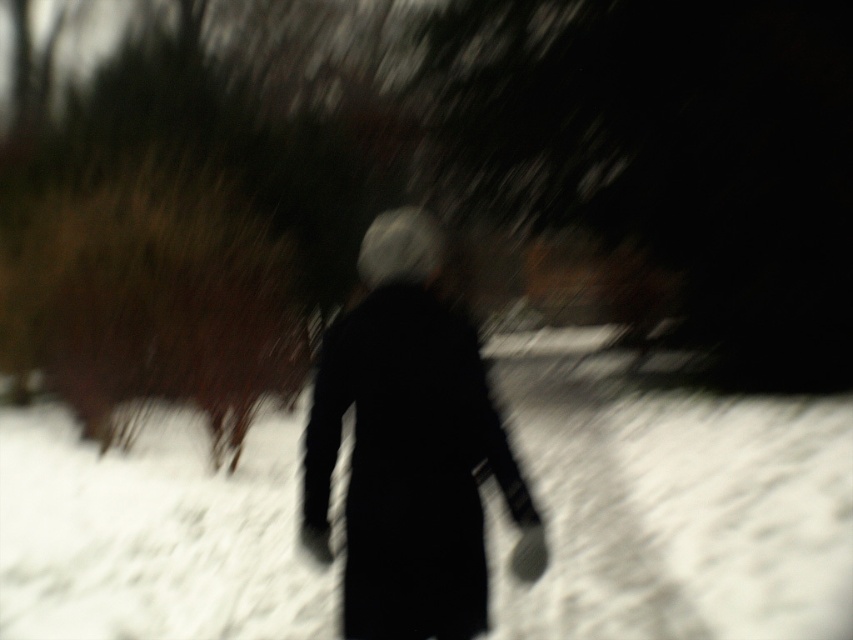
Question: Which point is farther from the camera taking this photo?

Choices:
 (A) (62, 460)
 (B) (456, 596)

Answer: (A)

Question: Does white fluffy snow at center appear on the left side of black matte coat at center?

Choices:
 (A) yes
 (B) no

Answer: (B)

Question: Is white fluffy snow at center behind black matte coat at center?

Choices:
 (A) no
 (B) yes

Answer: (B)

Question: Which object is farther from the camera taking this photo?

Choices:
 (A) white fluffy snow at center
 (B) black matte coat at center

Answer: (A)

Question: Observing the image, what is the correct spatial positioning of white fluffy snow at center in reference to black matte coat at center?

Choices:
 (A) below
 (B) above

Answer: (A)